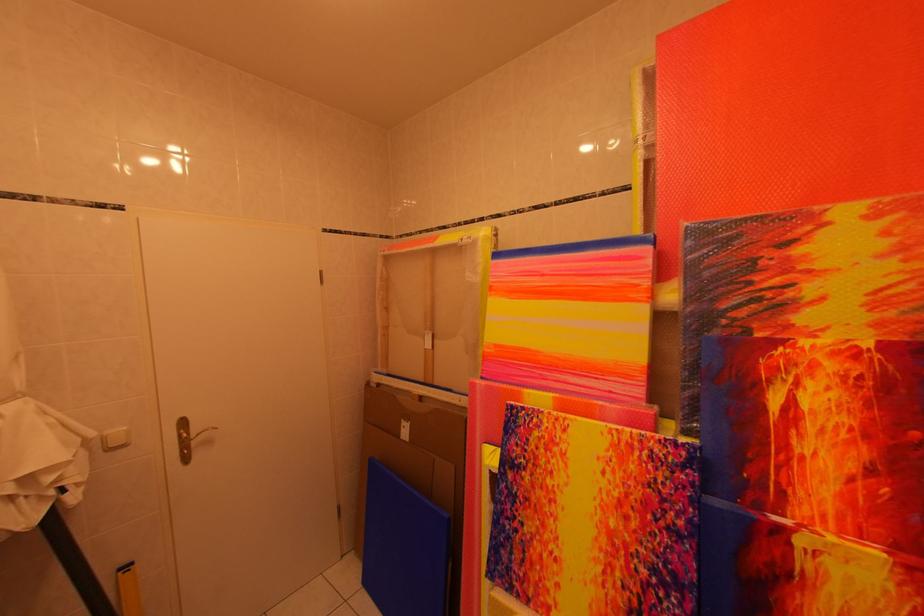
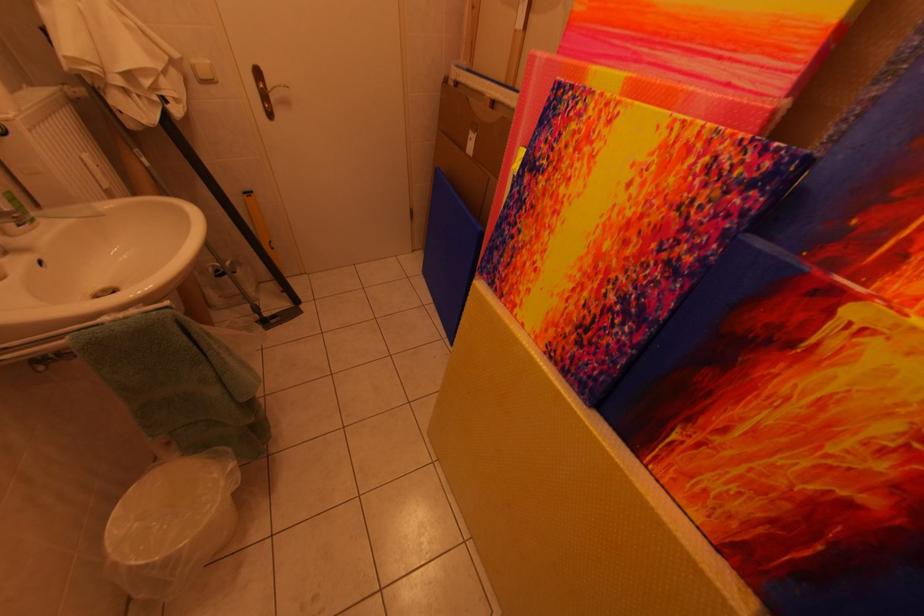
In the second image, find the point that corresponds to (548,475) in the first image.

(565, 180)